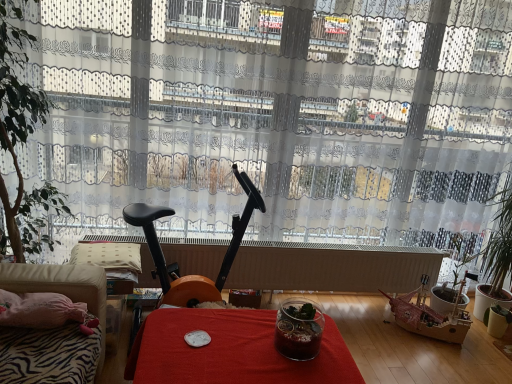
Image resolution: width=512 pixels, height=384 pixels. I want to click on free space that is to the left of transparent glass jar at center, so click(x=246, y=340).